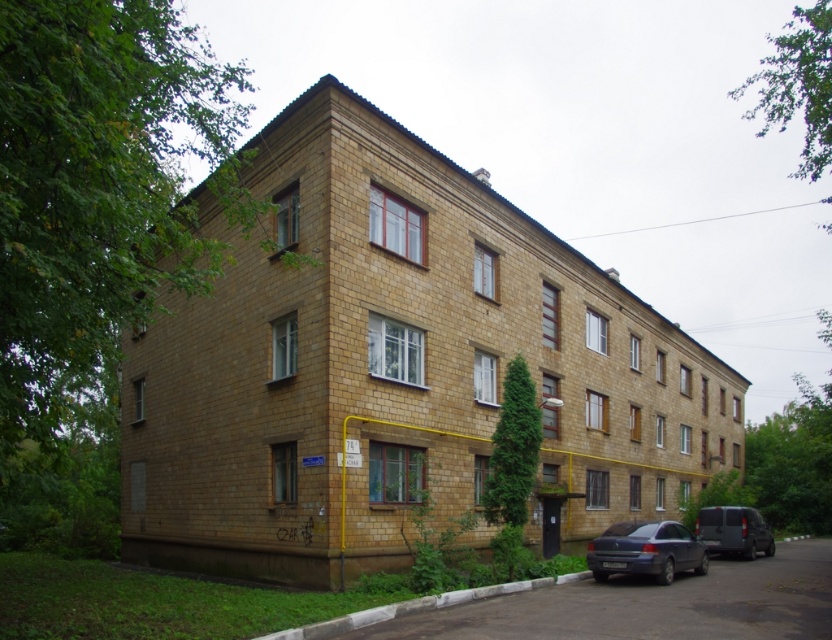
You are a delivery driver who needs to park your 4.5 meter long truck next to the building. The parking spot is between the metallic blue sedan at lower right and the dark gray matte van at lower right. Can your truck fit in the space between them?

The metallic blue sedan at lower right is shorter than the dark gray matte van at lower right. Since the truck is 4.5 meters long and the space between the two vehicles depends on their lengths, but the exact distance isn

You are a delivery person trying to park your van, the dark gray matte van at lower right, near the entrance of the building. However, there is a metallic blue sedan at lower right blocking the path. Based on their positions, can you maneuver your van around the sedan to reach the entrance?

The metallic blue sedan at lower right is positioned on the left side of the dark gray matte van at lower right. Since the sedan is to the left of your van, you can maneuver around it by moving to the right side of the sedan to access the entrance.

You are standing at the entrance of the building and want to park your metallic blue sedan at lower right. Based on the image, where should you position your car relative to the entrance?

The metallic blue sedan at lower right is located at coordinates (646, 550) in the image, which places it to the right side and slightly below the entrance area. To park there, position your car to the right of the entrance near the lower part of the building facade.